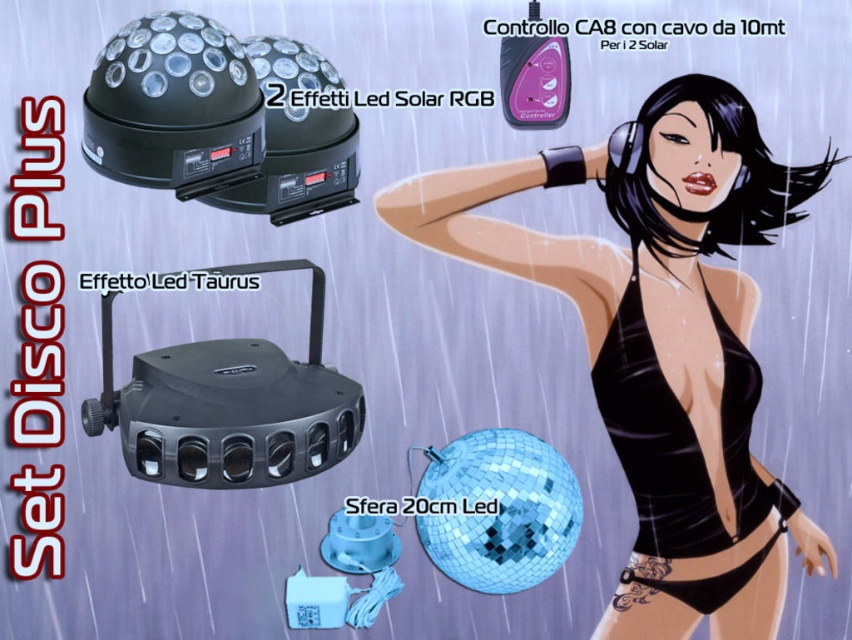
Looking at this image, does black glossy swimsuit at center appear over shiny blue disco ball at center?

Correct, black glossy swimsuit at center is located above shiny blue disco ball at center.

Can you confirm if black glossy swimsuit at center is positioned below shiny blue disco ball at center?

Actually, black glossy swimsuit at center is above shiny blue disco ball at center.

Is point (688, 627) less distant than point (465, 449)?

Yes, point (688, 627) is closer to viewer.

Where is `black glossy swimsuit at center`? Image resolution: width=852 pixels, height=640 pixels. black glossy swimsuit at center is located at coordinates (661, 342).

Between black plastic effetto led taurus at center and black satin bikini top at right, which one appears on the left side from the viewer's perspective?

From the viewer's perspective, black plastic effetto led taurus at center appears more on the left side.

Is black plastic effetto led taurus at center further to camera compared to black satin bikini top at right?

No, it is not.

Find the location of `black plastic effetto led taurus at center`. black plastic effetto led taurus at center is located at coordinates (228, 403).

Measure the distance between point (635, 262) and camera.

Point (635, 262) is 4.74 feet from camera.

Is black glossy swimsuit at center above black plastic effetto led taurus at center?

Correct, black glossy swimsuit at center is located above black plastic effetto led taurus at center.

Between point (747, 355) and point (140, 419), which one is positioned behind?

The point (747, 355) is more distant.

Where is `black glossy swimsuit at center`? This screenshot has height=640, width=852. black glossy swimsuit at center is located at coordinates (661, 342).